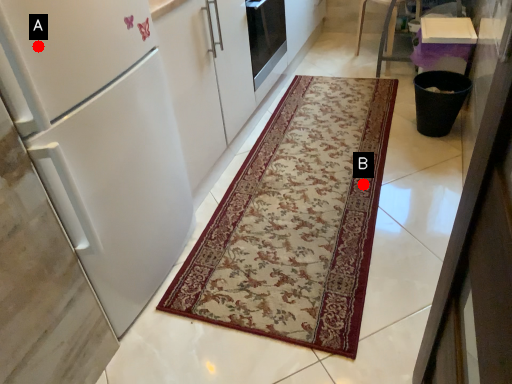
Question: Two points are circled on the image, labeled by A and B beside each circle. Which point is closer to the camera?

Choices:
 (A) A is closer
 (B) B is closer

Answer: (A)